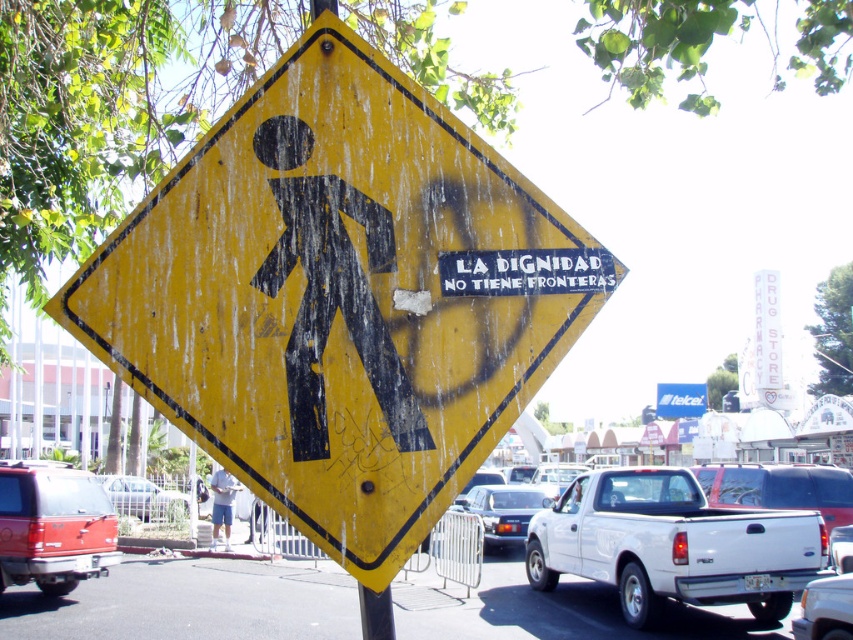
Does silver metallic sedan at lower left appear over light blue shorts at lower center?

Actually, silver metallic sedan at lower left is below light blue shorts at lower center.

Does point (171, 496) come closer to viewer compared to point (210, 547)?

No.

This screenshot has width=853, height=640. Identify the location of silver metallic sedan at lower left. (144, 499).

Based on the photo, who is positioned more to the left, yellow matte pedestrian crossing sign at center or light blue shorts at lower center?

light blue shorts at lower center

Is yellow matte pedestrian crossing sign at center to the left of light blue shorts at lower center from the viewer's perspective?

Incorrect, yellow matte pedestrian crossing sign at center is not on the left side of light blue shorts at lower center.

What do you see at coordinates (332, 298) in the screenshot? I see `yellow matte pedestrian crossing sign at center` at bounding box center [332, 298].

Where is `yellow matte pedestrian crossing sign at center`? yellow matte pedestrian crossing sign at center is located at coordinates (332, 298).

Does yellow faded pedestrian crossing sign at upper center appear over silver metallic sedan at lower left?

Yes, yellow faded pedestrian crossing sign at upper center is above silver metallic sedan at lower left.

Is the position of yellow faded pedestrian crossing sign at upper center less distant than that of silver metallic sedan at lower left?

Yes.

Where is `yellow faded pedestrian crossing sign at upper center`? The height and width of the screenshot is (640, 853). yellow faded pedestrian crossing sign at upper center is located at coordinates (525, 272).

Locate an element on the screen. This screenshot has height=640, width=853. yellow faded pedestrian crossing sign at upper center is located at coordinates (525, 272).